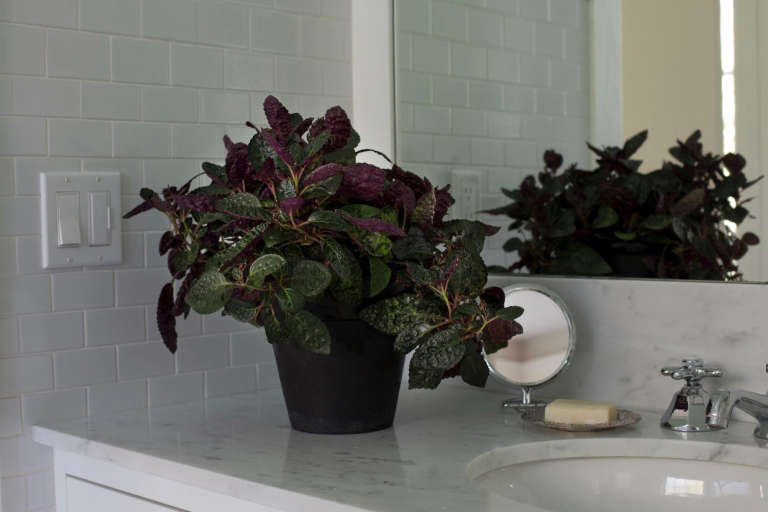
You are a GUI agent. You are given a task and a screenshot of the screen. Output one action in this format:
    pyautogui.click(x=<x>, y=<y>)
    Task: Click on the mirror
    The height and width of the screenshot is (512, 768).
    Given the screenshot: What is the action you would take?
    pyautogui.click(x=435, y=65)